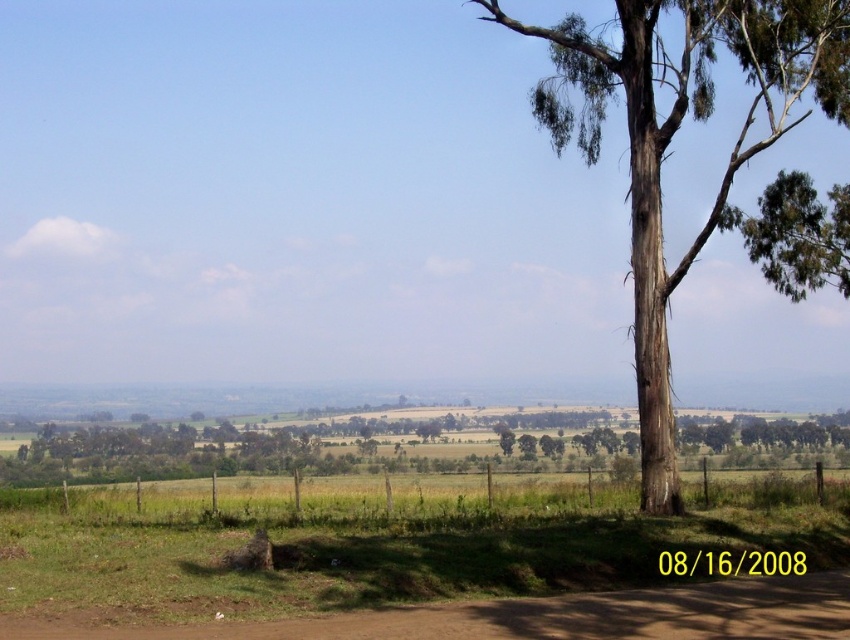
Question: Which point is closer to the camera?

Choices:
 (A) green leafy tree at upper right
 (B) green bark tree at right

Answer: (B)

Question: Does brown dirt track at lower center have a larger size compared to green leafy tree at upper right?

Choices:
 (A) yes
 (B) no

Answer: (B)

Question: Does brown dirt track at lower center appear over green leafy tree at upper right?

Choices:
 (A) yes
 (B) no

Answer: (B)

Question: Is the position of green bark tree at right more distant than that of green leafy tree at upper right?

Choices:
 (A) yes
 (B) no

Answer: (B)

Question: Which of the following is the farthest from the observer?

Choices:
 (A) brown dirt track at lower center
 (B) green bark tree at right

Answer: (B)

Question: Considering the real-world distances, which object is farthest from the green leafy tree at upper right?

Choices:
 (A) brown dirt track at lower center
 (B) green bark tree at right

Answer: (A)